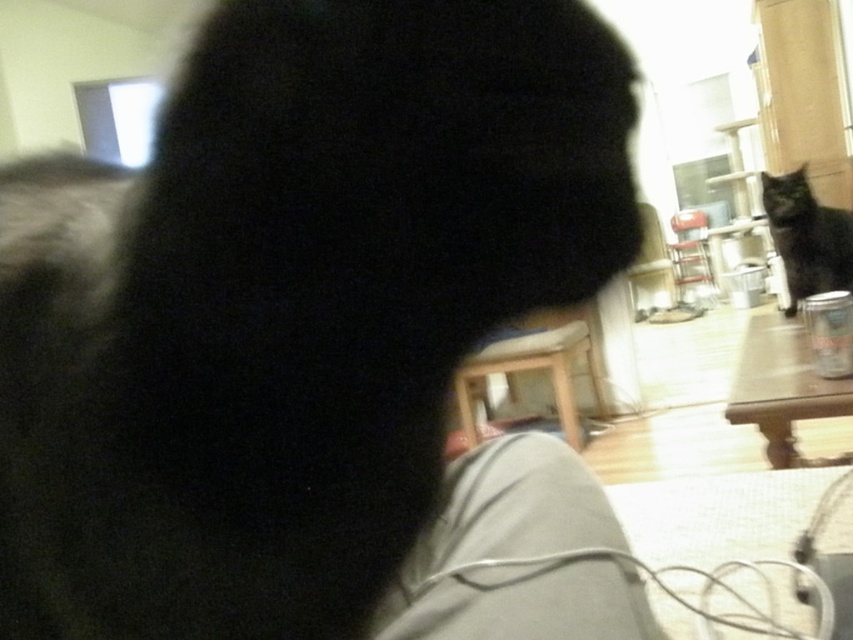
Does gray fabric at lower center have a smaller size compared to black fuzzy cat at upper right?

Correct, gray fabric at lower center occupies less space than black fuzzy cat at upper right.

Is gray fabric at lower center below black fuzzy cat at upper right?

Yes, gray fabric at lower center is below black fuzzy cat at upper right.

At what (x,y) coordinates should I click in order to perform the action: click on gray fabric at lower center. Please return your answer as a coordinate pair (x, y). This screenshot has width=853, height=640. Looking at the image, I should click on (517, 554).